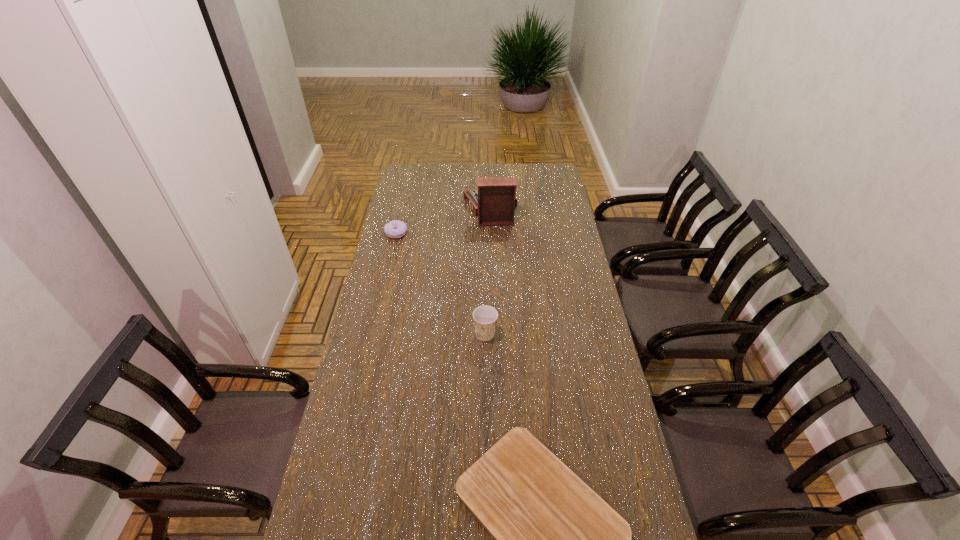
At what (x,y) coordinates should I click in order to perform the action: click on vacant position in the image that satisfies the following two spatial constraints: 1. on the back side of the second nearest object; 2. on the right side of the phonograph record. Please return your answer as a coordinate pair (x, y). This screenshot has height=540, width=960. Looking at the image, I should click on (484, 208).